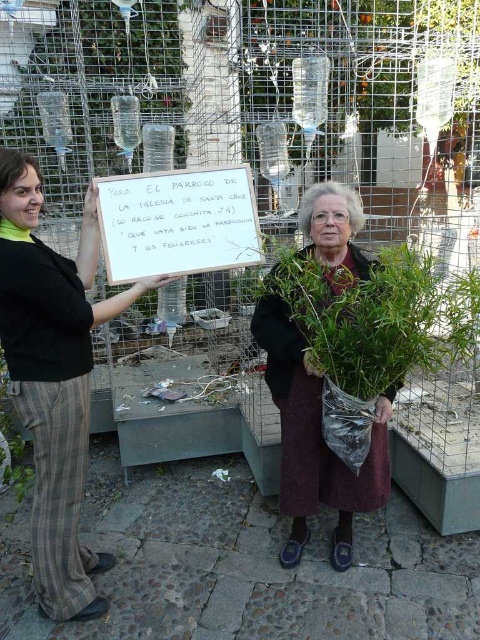
Question: Does black fabric pants at left appear under green leafy plant at center?

Choices:
 (A) yes
 (B) no

Answer: (A)

Question: Can you confirm if black fabric pants at left is smaller than green leafy plant at center?

Choices:
 (A) yes
 (B) no

Answer: (B)

Question: Among these objects, which one is nearest to the camera?

Choices:
 (A) maroon woolen sweater at center
 (B) white paper sign at center

Answer: (A)

Question: Which of the following is the closest to the observer?

Choices:
 (A) (39, 476)
 (B) (267, 339)

Answer: (A)

Question: Does black fabric pants at left appear on the right side of white paper sign at center?

Choices:
 (A) no
 (B) yes

Answer: (A)

Question: Which point is closer to the camera?

Choices:
 (A) black fabric pants at left
 (B) maroon woolen sweater at center
 (C) green leafy plant at center
 (D) white paper sign at center

Answer: (C)